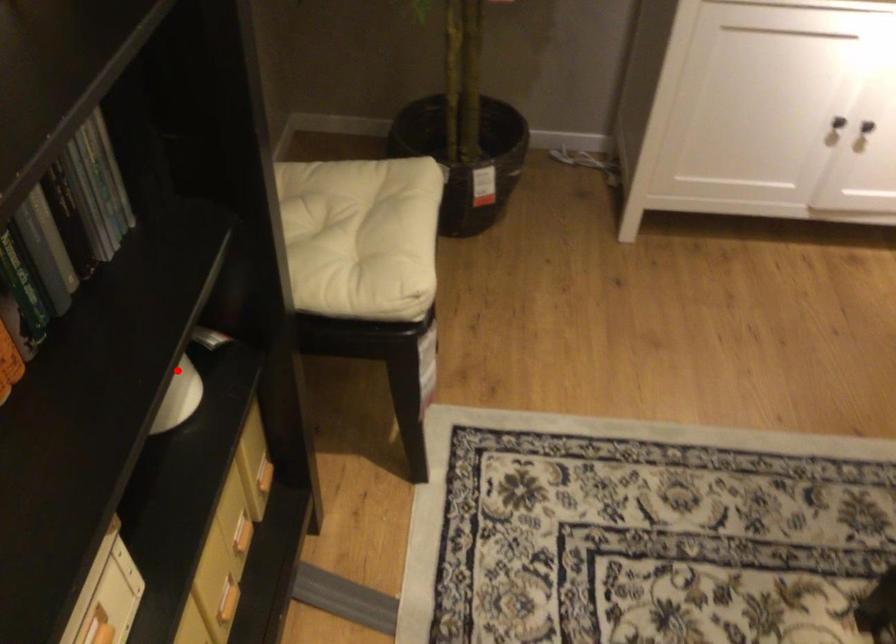
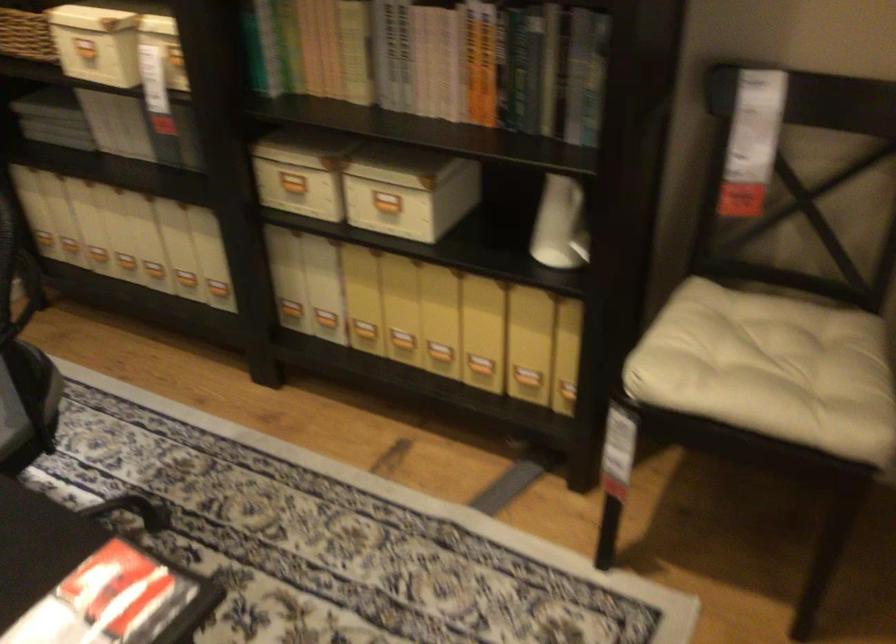
In the second image, find the point that corresponds to the highlighted location in the first image.

(582, 238)